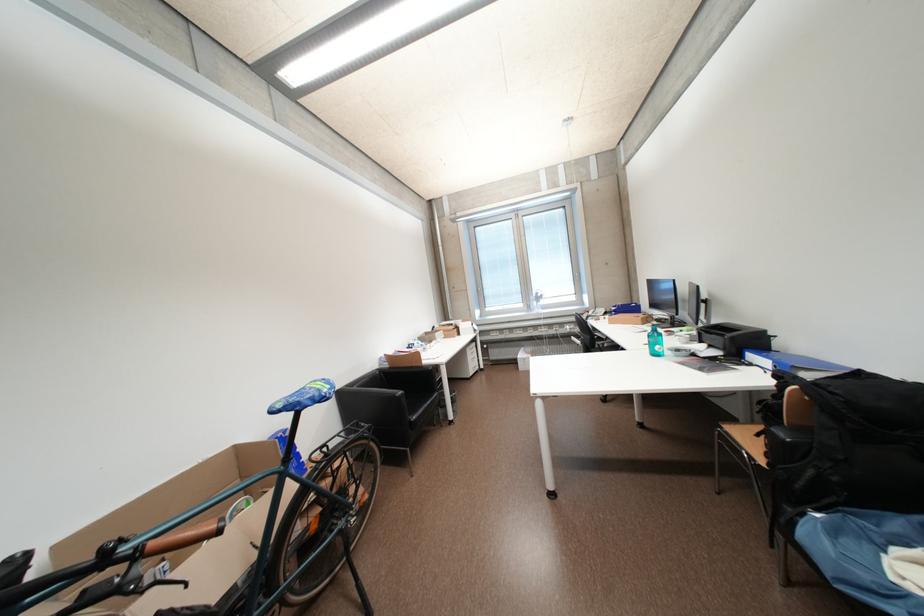
Where is `black sofa sitting surface`? Image resolution: width=924 pixels, height=616 pixels. black sofa sitting surface is located at coordinates (418, 400).